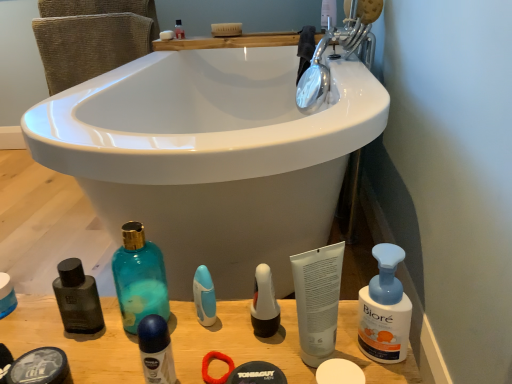
Locate an element on the screen. The width and height of the screenshot is (512, 384). vacant region to the left of white matte tube at center, the fifth toiletry positioned from the bottom is located at coordinates (221, 345).